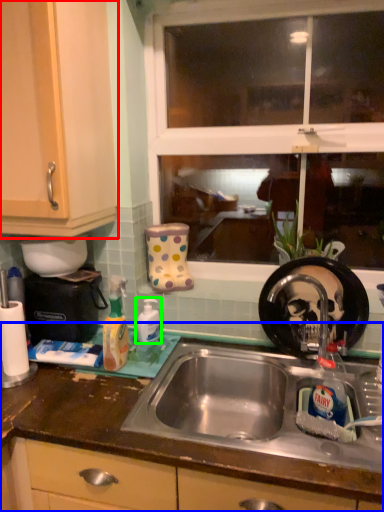
Question: Considering the real-world distances, which object is closest to cabinetry (highlighted by a red box)? countertop (highlighted by a blue box) or cleaning product (highlighted by a green box).

Choices:
 (A) countertop
 (B) cleaning product

Answer: (B)